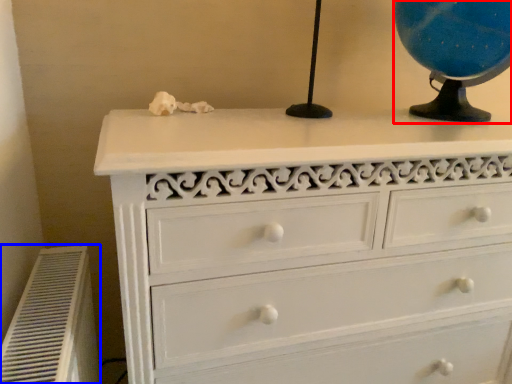
Question: Which of the following is the closest to the observer, table lamp (highlighted by a red box) or air conditioner (highlighted by a blue box)?

Choices:
 (A) table lamp
 (B) air conditioner

Answer: (B)